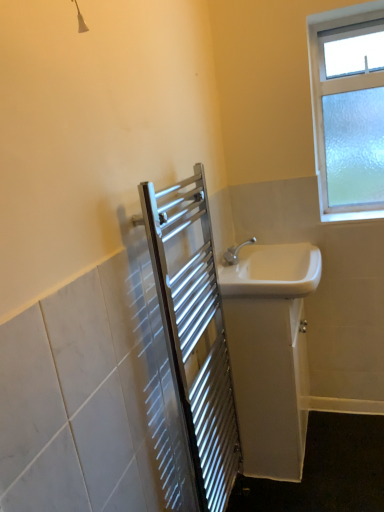
Question: Is white glossy sink at right, arranged as the second sink when ordered from the bottom, positioned beyond the bounds of white glossy sink at right, the first sink in the bottom-to-top sequence?

Choices:
 (A) yes
 (B) no

Answer: (A)

Question: Does white glossy sink at right, arranged as the first sink when viewed from the top, contain white glossy sink at right, the 2th sink from the top?

Choices:
 (A) no
 (B) yes

Answer: (A)

Question: Are white glossy sink at right, arranged as the first sink when viewed from the top, and white glossy sink at right, the first sink in the bottom-to-top sequence, far apart?

Choices:
 (A) yes
 (B) no

Answer: (B)

Question: Considering the relative positions of white glossy sink at right, arranged as the first sink when viewed from the top, and white glossy sink at right, the 2th sink from the top, in the image provided, is white glossy sink at right, arranged as the first sink when viewed from the top, to the left of white glossy sink at right, the 2th sink from the top, from the viewer's perspective?

Choices:
 (A) yes
 (B) no

Answer: (A)

Question: From the image's perspective, is white glossy sink at right, arranged as the second sink when ordered from the bottom, below white glossy sink at right, the first sink in the bottom-to-top sequence?

Choices:
 (A) yes
 (B) no

Answer: (B)

Question: From a real-world perspective, is polished stainless steel towel rack at center-left positioned above or below white glossy sink at right, arranged as the second sink when ordered from the bottom?

Choices:
 (A) below
 (B) above

Answer: (A)

Question: Do you think polished stainless steel towel rack at center-left is within white glossy sink at right, arranged as the first sink when viewed from the top, or outside of it?

Choices:
 (A) inside
 (B) outside

Answer: (B)

Question: In terms of height, does polished stainless steel towel rack at center-left look taller or shorter compared to white glossy sink at right, arranged as the second sink when ordered from the bottom?

Choices:
 (A) short
 (B) tall

Answer: (B)

Question: Considering the positions of polished stainless steel towel rack at center-left and white glossy sink at right, arranged as the first sink when viewed from the top, in the image, is polished stainless steel towel rack at center-left bigger or smaller than white glossy sink at right, arranged as the first sink when viewed from the top,?

Choices:
 (A) big
 (B) small

Answer: (A)

Question: From a real-world perspective, is white glossy sink at right, the first sink in the bottom-to-top sequence, physically located above or below white glossy sink at right, arranged as the second sink when ordered from the bottom?

Choices:
 (A) above
 (B) below

Answer: (B)

Question: Choose the correct answer: Is white glossy sink at right, the first sink in the bottom-to-top sequence, inside white glossy sink at right, arranged as the first sink when viewed from the top, or outside it?

Choices:
 (A) outside
 (B) inside

Answer: (A)

Question: Based on their sizes in the image, would you say white glossy sink at right, the 2th sink from the top, is bigger or smaller than white glossy sink at right, arranged as the first sink when viewed from the top?

Choices:
 (A) big
 (B) small

Answer: (A)

Question: Is white glossy sink at right, the first sink in the bottom-to-top sequence, wider or thinner than white glossy sink at right, arranged as the first sink when viewed from the top?

Choices:
 (A) thin
 (B) wide

Answer: (A)

Question: In terms of size, does white glossy sink at right, the first sink in the bottom-to-top sequence, appear bigger or smaller than frosted glass window at upper right?

Choices:
 (A) small
 (B) big

Answer: (B)

Question: Considering the relative positions of white glossy sink at right, the 2th sink from the top, and frosted glass window at upper right in the image provided, is white glossy sink at right, the 2th sink from the top, to the left or to the right of frosted glass window at upper right?

Choices:
 (A) left
 (B) right

Answer: (A)